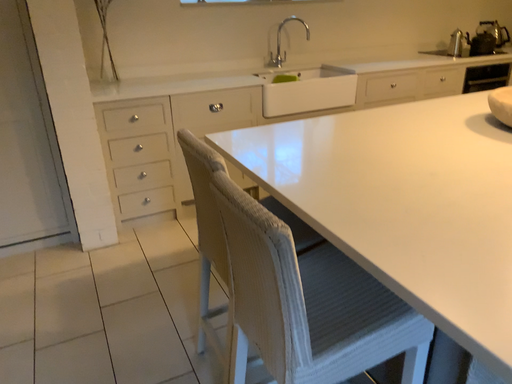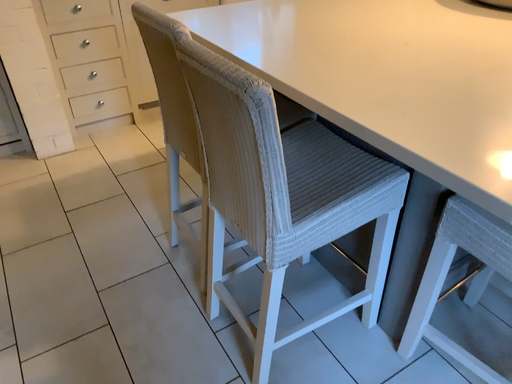
Question: Which way did the camera rotate in the video?

Choices:
 (A) rotated downward
 (B) rotated upward

Answer: (A)